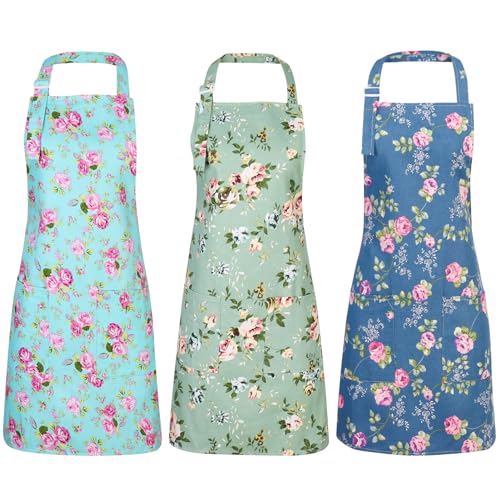
Where is `bust`? The height and width of the screenshot is (500, 500). bust is located at coordinates (473, 138), (365, 145), (301, 150), (193, 146), (130, 145), (28, 150).